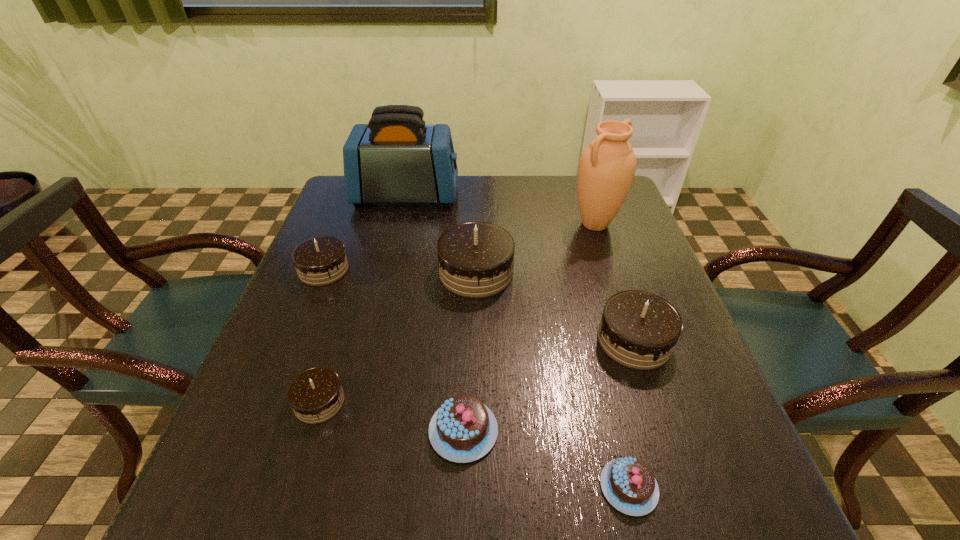
The height and width of the screenshot is (540, 960). What are the coordinates of `blank region between the toaster and the nearest chocolate chocolate cake` in the screenshot? It's located at (363, 299).

Locate an element on the screen. This screenshot has height=540, width=960. the fifth closest object to the urn is located at coordinates (321, 260).

I want to click on object that stands as the second closest to the biggest chocolate chocolate cake, so click(639, 330).

At what (x,y) coordinates should I click in order to perform the action: click on chocolate cake that is the second nearest to the second biggest chocolate chocolate cake. Please return your answer as a coordinate pair (x, y). Looking at the image, I should click on (628, 484).

I want to click on chocolate cake that is the second nearest to the urn, so click(639, 330).

Locate which chocolate chocolate cake ranks fourth in proximity to the right pink chocolate cake. Please provide its 2D coordinates. Your answer should be formatted as a tuple, i.e. [(x, y)], where the tuple contains the x and y coordinates of a point satisfying the conditions above.

[(321, 260)]

I want to click on the closest chocolate chocolate cake to the blue toaster, so pyautogui.click(x=476, y=259).

I want to click on vacant region that satisfies the following two spatial constraints: 1. on the front-facing side of the blue toaster; 2. on the front side of the third biggest chocolate chocolate cake, so click(389, 269).

Locate an element on the screen. vacant region that satisfies the following two spatial constraints: 1. on the front side of the shortest chocolate cake; 2. on the left side of the left pink chocolate cake is located at coordinates (462, 487).

Identify the location of free space in the image that satisfies the following two spatial constraints: 1. on the front-facing side of the toaster; 2. on the back side of the third tallest object. (388, 272).